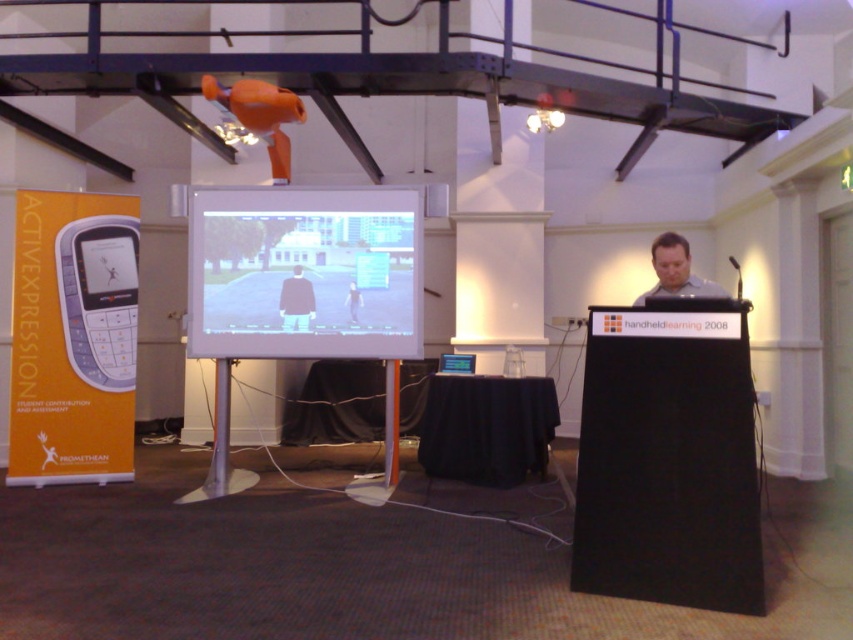
Question: Estimate the real-world distances between objects in this image. Which object is closer to the black matte jacket at center?

Choices:
 (A) matte gray laptop at center
 (B) matte black phone at center-left
 (C) white glossy projection screen at center

Answer: (C)

Question: Among these points, which one is farthest from the camera?

Choices:
 (A) (283, 323)
 (B) (711, 291)
 (C) (289, 234)
 (D) (123, 288)

Answer: (D)

Question: Is white glossy projection screen at center smaller than black matte jacket at center?

Choices:
 (A) yes
 (B) no

Answer: (B)

Question: Among these points, which one is nearest to the camera?

Choices:
 (A) (196, 252)
 (B) (289, 323)
 (C) (97, 256)
 (D) (643, 301)

Answer: (D)

Question: Does matte gray laptop at center have a larger size compared to matte black phone at center-left?

Choices:
 (A) yes
 (B) no

Answer: (A)

Question: Is white glossy projection screen at center below matte black phone at center-left?

Choices:
 (A) yes
 (B) no

Answer: (A)